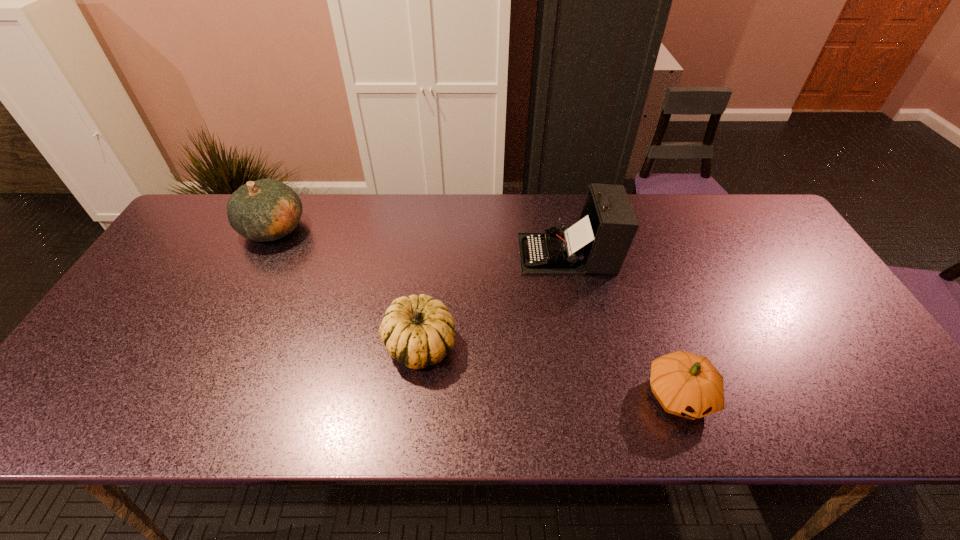
Where is `typewriter`? typewriter is located at coordinates (598, 243).

The height and width of the screenshot is (540, 960). Find the location of `the third shortest object`. the third shortest object is located at coordinates (263, 210).

The height and width of the screenshot is (540, 960). I want to click on the leftmost object, so click(263, 210).

Identify the location of the second gourd from right to left. (418, 331).

The height and width of the screenshot is (540, 960). Identify the location of the rightmost gourd. (688, 385).

Identify the location of free space located 0.200m inside the open case of the typewriter. The width and height of the screenshot is (960, 540). [450, 254].

In order to click on vacant space situated inside the open case of the typewriter in this screenshot , I will do `click(464, 254)`.

Image resolution: width=960 pixels, height=540 pixels. Identify the location of free spot located inside the open case of the typewriter. (426, 254).

Where is `vacant space located on the front of the leftmost object`? The height and width of the screenshot is (540, 960). vacant space located on the front of the leftmost object is located at coordinates (252, 271).

What are the coordinates of `free location located 0.120m on the right of the second gourd from right to left` in the screenshot? It's located at (505, 346).